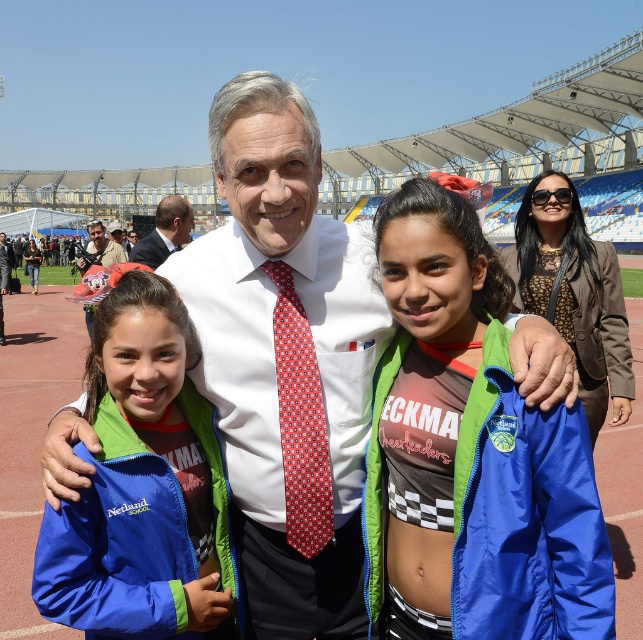
Question: Which point is farther from the camera taking this photo?

Choices:
 (A) (159, 221)
 (B) (368, 301)

Answer: (A)

Question: Can you confirm if blue fabric jacket at left is thinner than matte white shirt at center?

Choices:
 (A) yes
 (B) no

Answer: (A)

Question: Does white smooth shirt at center come in front of matte red tie at center?

Choices:
 (A) yes
 (B) no

Answer: (A)

Question: Which point is closer to the camera taking this photo?

Choices:
 (A) (x=183, y=234)
 (B) (x=282, y=262)
 (C) (x=104, y=237)

Answer: (B)

Question: Among these objects, which one is nearest to the camera?

Choices:
 (A) blue nylon jacket at center
 (B) smooth brown suit at upper left
 (C) matte red tie at center

Answer: (A)

Question: Is blue nylon jacket at center bigger than red printed tie at center?

Choices:
 (A) yes
 (B) no

Answer: (A)